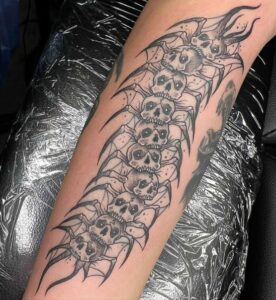
The image size is (276, 300). I want to click on armrest, so click(x=207, y=203).